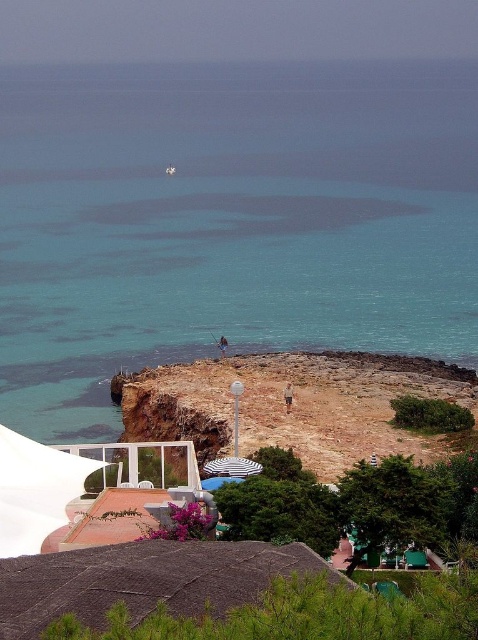
Which of these two, white fabric canopy at lower left or white striped umbrella at lower center, stands taller?

Standing taller between the two is white fabric canopy at lower left.

Is point (8, 528) farther from viewer compared to point (261, 468)?

No.

Does point (78, 465) come in front of point (235, 458)?

Yes, point (78, 465) is in front of point (235, 458).

The height and width of the screenshot is (640, 478). What are the coordinates of `white fabric canopy at lower left` in the screenshot? It's located at (35, 490).

Does point (229, 458) come behind point (239, 476)?

Yes.

Based on the photo, who is lower down, white striped umbrella at lower center or white striped umbrella at center?

white striped umbrella at center is lower down.

What do you see at coordinates (231, 467) in the screenshot?
I see `white striped umbrella at lower center` at bounding box center [231, 467].

The width and height of the screenshot is (478, 640). Identify the location of white striped umbrella at lower center. (231, 467).

Is clear blue water at center further to camera compared to white sand beach at lower center?

That is True.

Which is behind, point (57, 252) or point (365, 438)?

The point (57, 252) is more distant.

Identify the location of clear blue water at center. (217, 282).